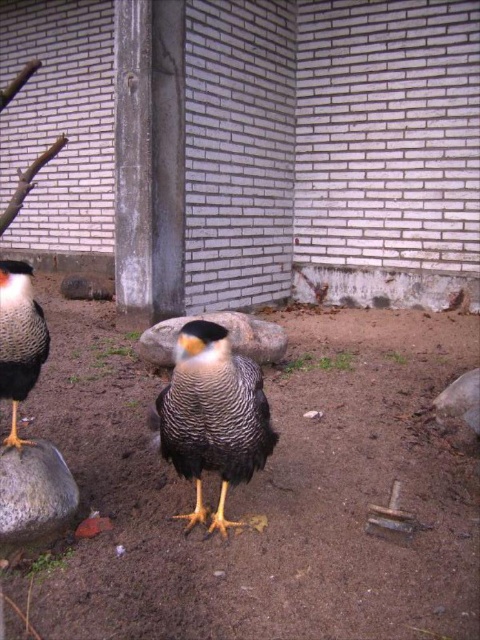
Question: Which object is the closest to the speckled feathers bird at center?

Choices:
 (A) gray smooth rock at lower left
 (B) brown sandy soil at center

Answer: (A)

Question: Considering the relative positions of brown sandy soil at center and gray smooth rock at center in the image provided, where is brown sandy soil at center located with respect to gray smooth rock at center?

Choices:
 (A) below
 (B) above

Answer: (A)

Question: Estimate the real-world distances between objects in this image. Which object is closer to the gray smooth rock at center?

Choices:
 (A) gray smooth rock at lower left
 (B) speckled feathered bird at left
 (C) brown sandy soil at center

Answer: (C)

Question: Which of the following is the farthest from the observer?

Choices:
 (A) gray smooth rock at lower left
 (B) speckled feathered bird at left

Answer: (A)

Question: Does gray smooth rock at lower left appear under gray smooth rock at center?

Choices:
 (A) no
 (B) yes

Answer: (B)

Question: Does gray smooth rock at lower left have a larger size compared to gray smooth rock at center?

Choices:
 (A) yes
 (B) no

Answer: (B)